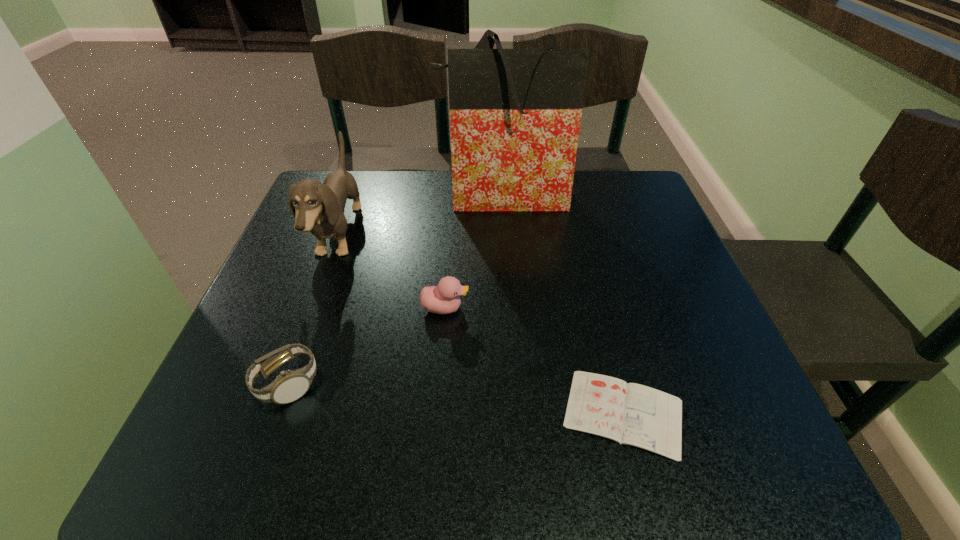
The image size is (960, 540). I want to click on vacant area at the left edge of the desktop, so click(x=238, y=354).

In the image, there is a desktop. What are the coordinates of `vacant space at the right edge` in the screenshot? It's located at (713, 387).

The height and width of the screenshot is (540, 960). Find the location of `vacant area at the far left corner of the desktop`. vacant area at the far left corner of the desktop is located at coordinates (363, 183).

Image resolution: width=960 pixels, height=540 pixels. I want to click on vacant space at the near left corner, so click(x=253, y=428).

I want to click on vacant space at the far right corner of the desktop, so click(x=648, y=210).

Find the location of a particular element. vacant point located between the puppy and the duckling is located at coordinates (392, 272).

The height and width of the screenshot is (540, 960). Identify the location of free spot between the shortest object and the watch. (455, 399).

Locate an element on the screen. The width and height of the screenshot is (960, 540). free spot between the diary and the second shortest object is located at coordinates (455, 399).

The image size is (960, 540). Identify the location of free space between the watch and the puppy. (313, 309).

Find the location of a particular element. The image size is (960, 540). empty location between the diary and the fourth tallest object is located at coordinates (455, 399).